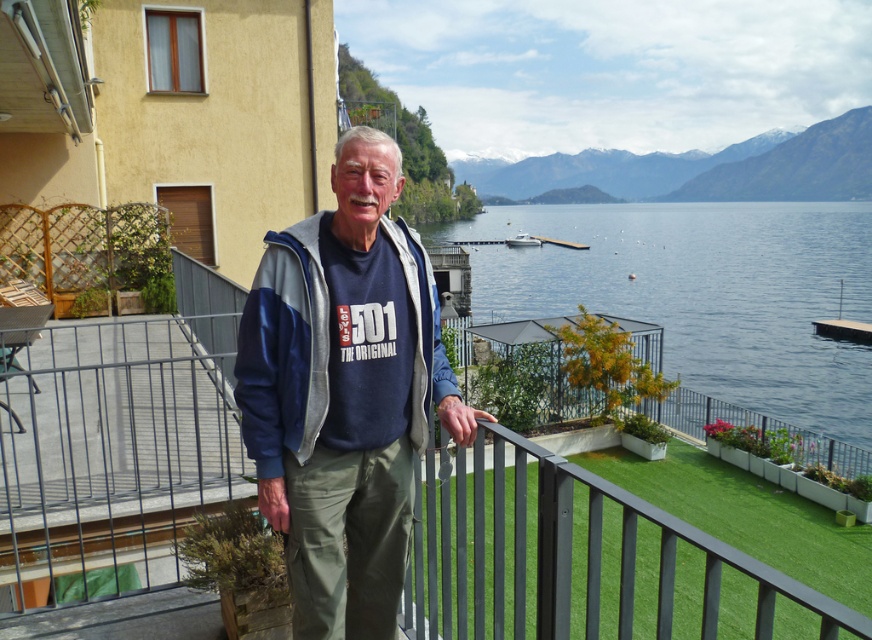
You are a photographer positioned on the balcony. You want to capture a photo of the white glossy boat at center and the blue water at center in the same frame. Based on their positions, which object should appear closer to the front of the photo?

The blue water at center is in front of the white glossy boat at center, so the blue water at center will appear closer to the front of the photo.

You are standing on the balcony and want to reach the point marked as point (x=298, y=362). The distance from you to that point is 7.15 feet. If you have a 6.5 feet long fishing rod, can you safely reach that point without stepping off the balcony?

The distance to point (x=298, y=362) is 7.15 feet, which is longer than your 6.5 feet fishing rod. Therefore, you cannot safely reach that point with the fishing rod alone.

The man is wearing a navy blue tshirt and a matte blue jacket at center. He wants to hand the jacket to his friend who is standing 6.99 feet away. Can he reach his friend by extending his arm? Assume the man can reach 2 feet in front of himself.

The distance between the man and his friend is 6.99 feet, which is greater than the man can reach 2 feet in front of himself. So the man cannot reach his friend by extending his arm.